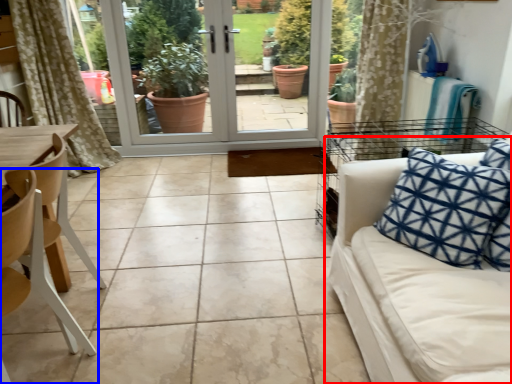
Question: Among these objects, which one is farthest to the camera, studio couch (highlighted by a red box) or chair (highlighted by a blue box)?

Choices:
 (A) studio couch
 (B) chair

Answer: (B)